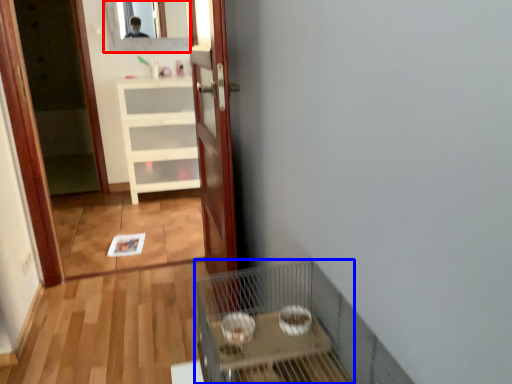
Question: Among these objects, which one is nearest to the camera, mirror (highlighted by a red box) or cage (highlighted by a blue box)?

Choices:
 (A) mirror
 (B) cage

Answer: (B)